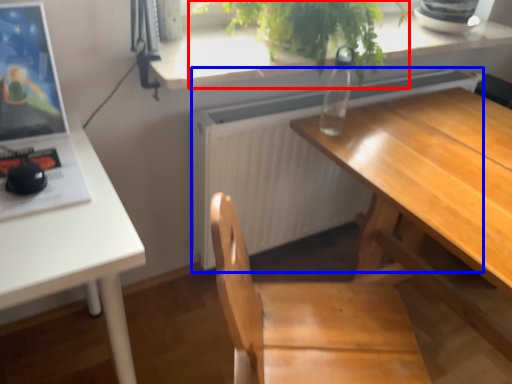
Question: Among these objects, which one is nearest to the camera, houseplant (highlighted by a red box) or radiator (highlighted by a blue box)?

Choices:
 (A) houseplant
 (B) radiator

Answer: (A)